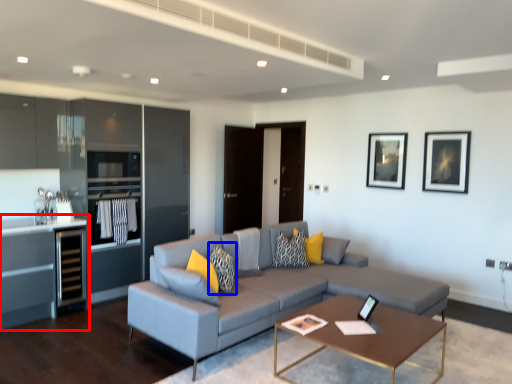
Question: Which of the following is the closest to the observer, cabinetry (highlighted by a red box) or pillow (highlighted by a blue box)?

Choices:
 (A) cabinetry
 (B) pillow

Answer: (B)